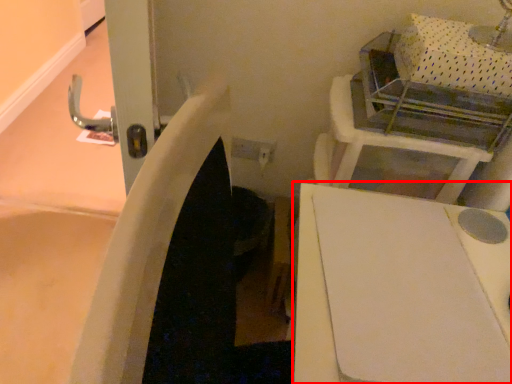
Question: From the image's perspective, what is the correct spatial positioning of furniture (annotated by the red box) in reference to vanity?

Choices:
 (A) below
 (B) above

Answer: (A)